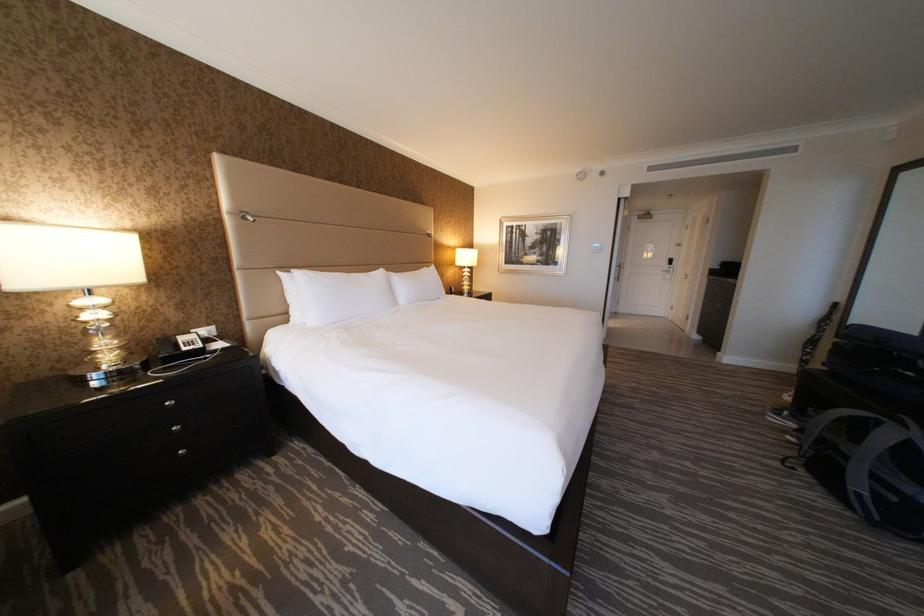
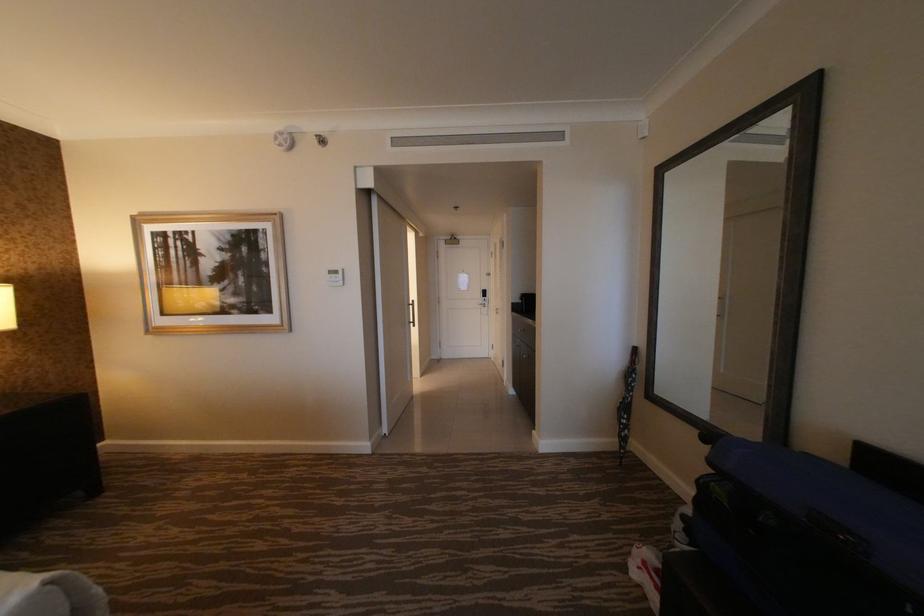
What movement of the cameraman would produce the second image?

The movement direction of the cameraman is right, forward.